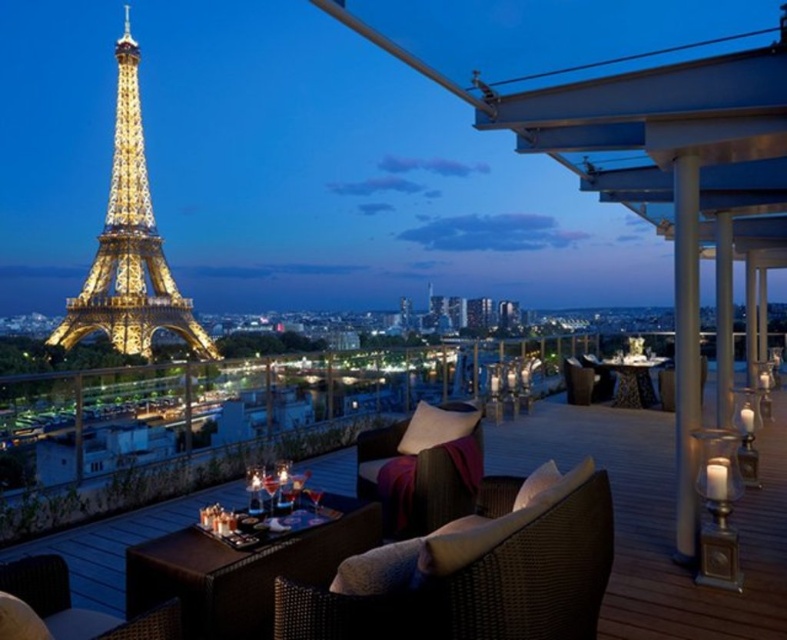
You are standing on the rooftop terrace and want to place a new potted plant exactly at the point marked by the coordinates point (660, 518). According to the scene description, where should you place the potted plant?

The brown wicker furniture at center is located at point (660, 518), so you should place the potted plant at the location of the brown wicker furniture at center.

You are standing on the rooftop terrace and want to know how far the point at coordinates point [512,584] is from you. Can you determine the distance?

The point at coordinates point [512,584] is 394.74 feet away from you.

You are standing at the edge of the rooftop terrace and want to move towards the brown wicker furniture at center. Based on the coordinates provided, in which direction should you walk from your current position to reach it?

Since the brown wicker furniture at center is located at coordinates point (660, 518), you should walk towards the center of the rooftop terrace to reach it.